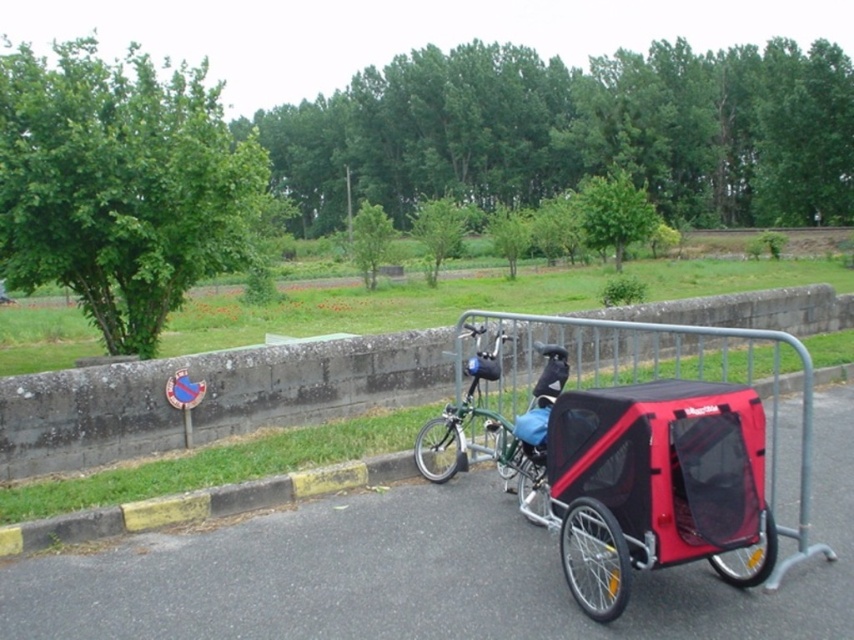
Is red plastic trailer at center shorter than green matte bicycle at center?

In fact, red plastic trailer at center may be taller than green matte bicycle at center.

Is red plastic trailer at center thinner than green matte bicycle at center?

Incorrect, red plastic trailer at center's width is not less than green matte bicycle at center's.

Who is more forward, [524,349] or [496,432]?

Point [496,432]

The image size is (854, 640). Identify the location of red plastic trailer at center. (630, 444).

Which is in front, point (736, 556) or point (709, 396)?

Point (709, 396)

Who is more distant from viewer, (752, 502) or (619, 419)?

The point (752, 502) is behind.

At what (x,y) coordinates should I click in order to perform the action: click on red plastic trailer at center. Please return your answer as a coordinate pair (x, y). This screenshot has width=854, height=640. Looking at the image, I should click on (630, 444).

Between metallic gray barrier at center and red mesh baby carriage at right, which one has more height?

metallic gray barrier at center is taller.

The image size is (854, 640). Describe the element at coordinates (209, 397) in the screenshot. I see `metallic gray barrier at center` at that location.

Between point (26, 451) and point (609, 579), which one is positioned in front?

Point (609, 579)

At what (x,y) coordinates should I click in order to perform the action: click on metallic gray barrier at center. Please return your answer as a coordinate pair (x, y). Looking at the image, I should click on (209, 397).